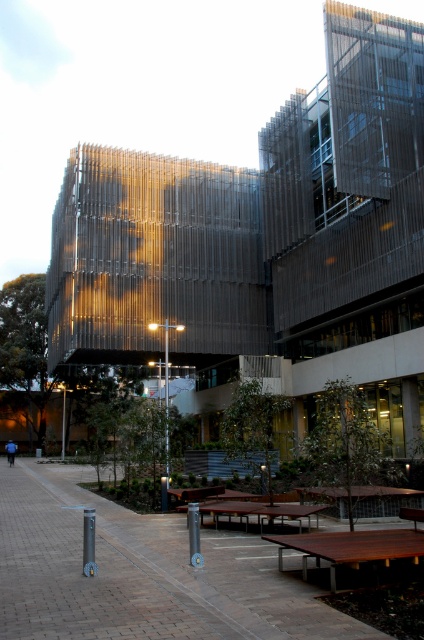
You are a photographer standing at the camera position. You want to place a 2.5 meter wide banner between the brown wooden tables at center and the camera. Is there enough space to do so without folding the banner?

The distance between the brown wooden tables at center and the camera is 5.42 meters. Since the banner is 2.5 meters wide, there is sufficient space to place it without folding, as 5.42 meters is greater than 2.5 meters.

You are standing on the paved walkway and want to sit down. You see a metallic pole at center and a brown wooden bench at center. Which object is closer to you so you can reach it first?

The metallic pole at center is closer to you than the brown wooden bench at center, so you can reach it first.